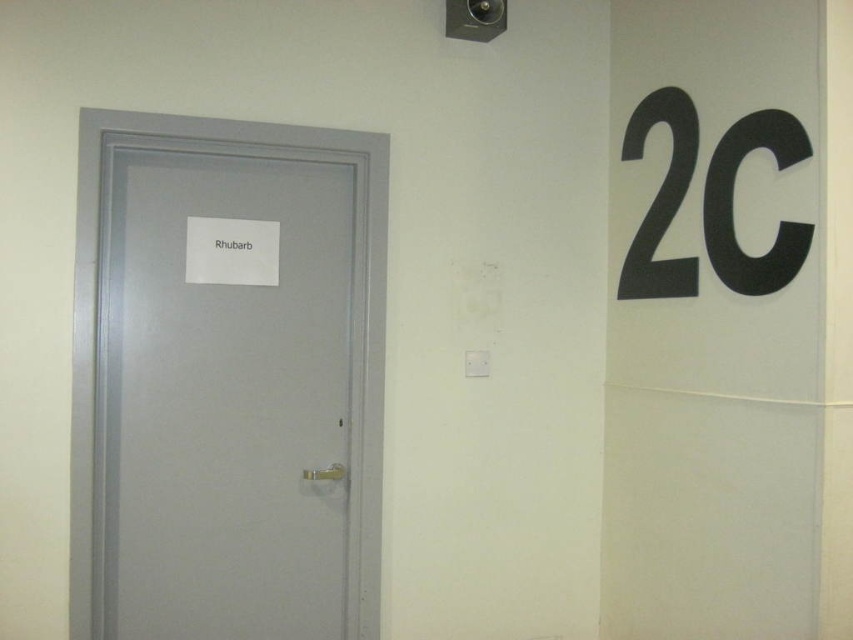
Question: Is matte gray door at left to the right of black plastic number at upper right from the viewer's perspective?

Choices:
 (A) no
 (B) yes

Answer: (A)

Question: Among these objects, which one is farthest from the camera?

Choices:
 (A) matte gray door at left
 (B) black plastic number at upper right

Answer: (A)

Question: Which object appears farthest from the camera in this image?

Choices:
 (A) matte gray door at left
 (B) black plastic number at upper right

Answer: (A)

Question: Is matte gray door at left below black plastic number at upper right?

Choices:
 (A) yes
 (B) no

Answer: (A)

Question: Which point is closer to the camera?

Choices:
 (A) black plastic number at upper right
 (B) matte gray door at left

Answer: (A)

Question: Is matte gray door at left thinner than black plastic number at upper right?

Choices:
 (A) yes
 (B) no

Answer: (B)